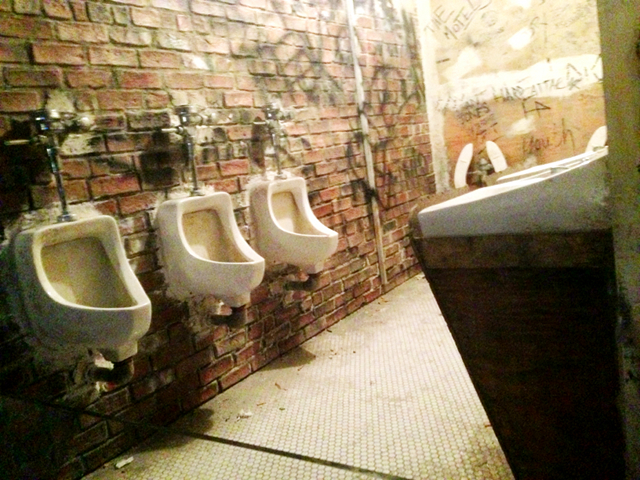
The image size is (640, 480). Identify the location of sink. (557, 209).